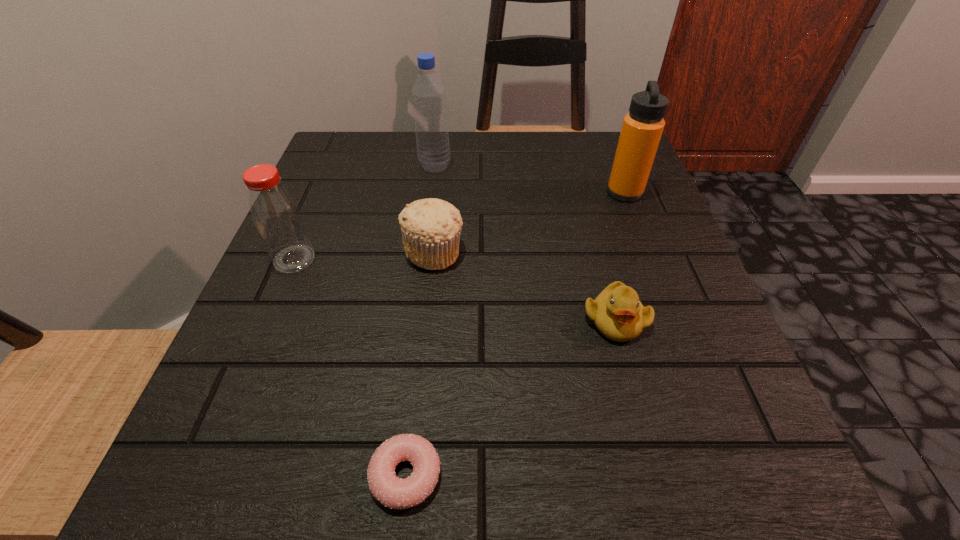
Locate an element on the screen. The height and width of the screenshot is (540, 960). object that is positioned at the left edge is located at coordinates (276, 215).

Find the location of a particular element. This screenshot has width=960, height=540. thermos bottle located in the right edge section of the desktop is located at coordinates (642, 128).

The height and width of the screenshot is (540, 960). Identify the location of duckling located at the right edge. (617, 313).

Locate an element on the screen. This screenshot has width=960, height=540. object that is at the far right corner is located at coordinates (642, 128).

The image size is (960, 540). Identify the location of free space at the far edge. (560, 154).

I want to click on blank area at the near edge, so click(x=530, y=474).

Identify the location of vacant area at the left edge. (326, 324).

The width and height of the screenshot is (960, 540). I want to click on vacant space at the right edge, so click(x=631, y=256).

Find the location of a particular element. This screenshot has width=960, height=540. free location at the far left corner is located at coordinates (329, 160).

Identify the location of vacant area at the near left corner of the desktop. (261, 443).